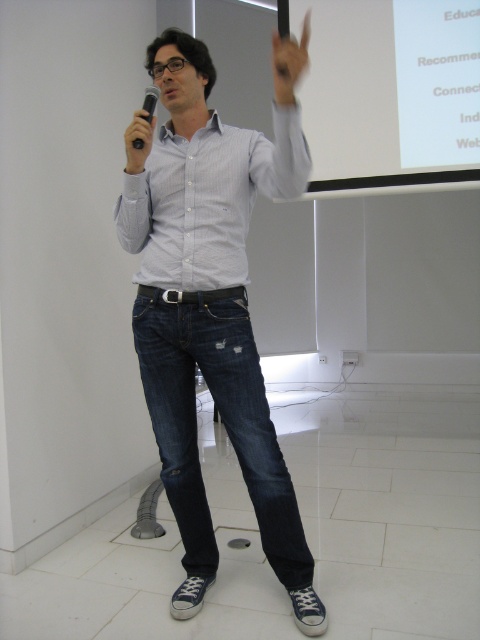
Can you confirm if denim jeans at center is positioned below white matte projection screen at upper center?

Yes, denim jeans at center is below white matte projection screen at upper center.

Does point (245, 412) lie in front of point (428, 140)?

Yes, it is.

This screenshot has width=480, height=640. In order to click on denim jeans at center in this screenshot , I will do `click(213, 305)`.

Does denim jeans at center have a smaller size compared to matte black microphone at left?

Incorrect, denim jeans at center is not smaller in size than matte black microphone at left.

Who is shorter, denim jeans at center or matte black microphone at left?

Standing shorter between the two is matte black microphone at left.

Who is more forward, [136,282] or [127,132]?

Point [127,132] is in front.

The height and width of the screenshot is (640, 480). I want to click on denim jeans at center, so click(213, 305).

Which of these two, denim jeans at center or white striped shirt at center, stands shorter?

Standing shorter between the two is white striped shirt at center.

Is point (312, 570) more distant than point (302, 168)?

That is True.

Who is more forward, (262, 540) or (172, 179)?

Point (172, 179) is in front.

You are a GUI agent. You are given a task and a screenshot of the screen. Output one action in this format:
    pyautogui.click(x=<x>, y=<y>)
    Task: Click on the denim jeans at center
    
    Given the screenshot: What is the action you would take?
    pyautogui.click(x=213, y=305)